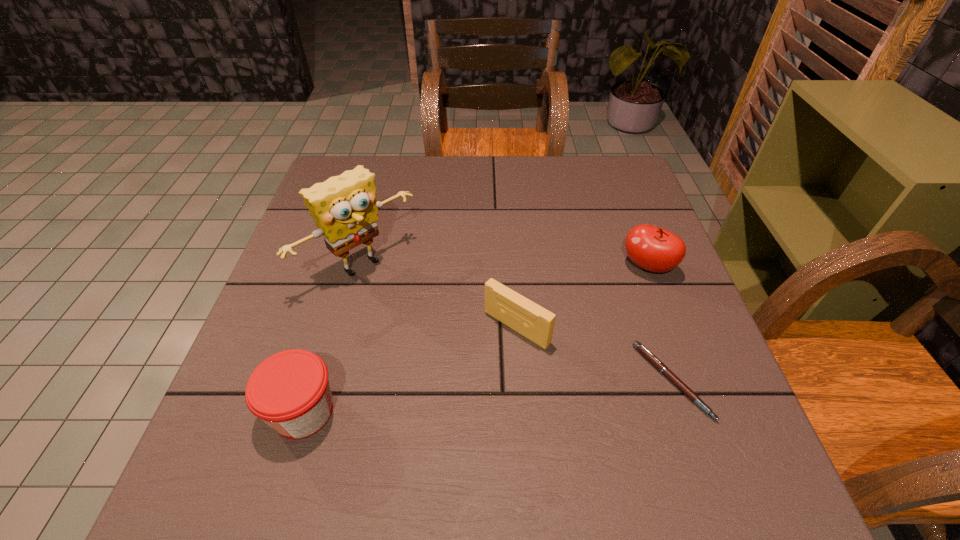
Identify the location of the third closest object to the third object from left to right. (652, 248).

I want to click on vacant region that satisfies the following two spatial constraints: 1. on the front side of the videotape; 2. at the nib of the pen, so click(520, 381).

At what (x,y) coordinates should I click in order to perform the action: click on vacant point that satisfies the following two spatial constraints: 1. on the front side of the pen; 2. at the nib of the sponge. Please return your answer as a coordinate pair (x, y). Image resolution: width=960 pixels, height=540 pixels. Looking at the image, I should click on (330, 381).

You are a GUI agent. You are given a task and a screenshot of the screen. Output one action in this format:
    pyautogui.click(x=<x>, y=<y>)
    Task: Click on the vacant region that satisfies the following two spatial constraints: 1. on the front side of the tallest object; 2. at the nib of the shortest object
    This screenshot has width=960, height=540.
    Given the screenshot: What is the action you would take?
    point(330,381)